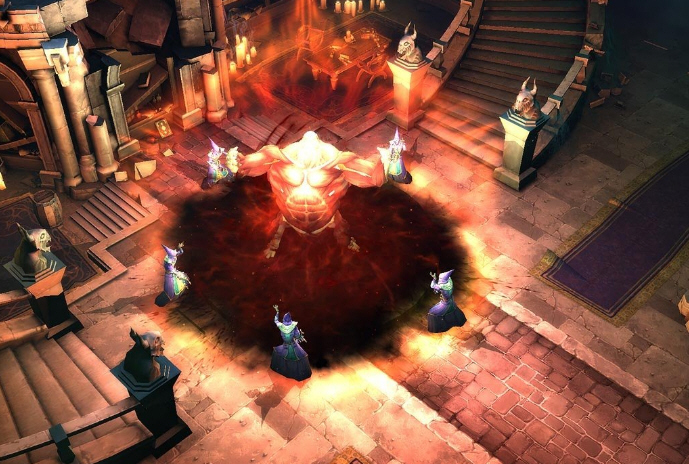
You are a GUI agent. You are given a task and a screenshot of the screen. Output one action in this format:
    pyautogui.click(x=<x>, y=<y>)
    Task: Click on the stairs
    Image resolution: width=689 pixels, height=464 pixels.
    Given the screenshot: What is the action you would take?
    pyautogui.click(x=48, y=382), pyautogui.click(x=471, y=108)